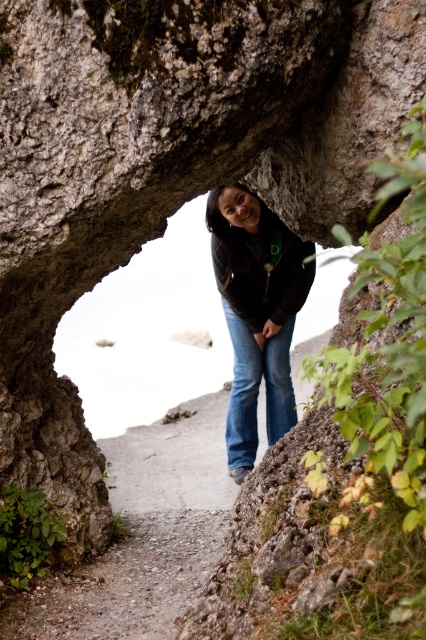
You are a hiker carrying a backpack that is 20 inches wide. You want to walk along the smooth concrete path at center while keeping your matte black jacket at center on your back. Will your backpack fit through the space between the path and your jacket?

The distance between the smooth concrete path at center and the matte black jacket at center is 36.29 inches. Since your backpack is 20 inches wide, it will fit as long as the backpack is kept centered and does not extend beyond the path width. However, ensure the backpack does not protrude sideways beyond the 36.29 inch clearance.

You are a hiker who wants to walk along the smooth concrete path at center while wearing the matte black jacket at center. Considering the path and jacket sizes, will you have enough space to walk comfortably?

The smooth concrete path at center is wider than the matte black jacket at center, so yes, there is sufficient space to walk comfortably along the path while wearing the matte black jacket at center.